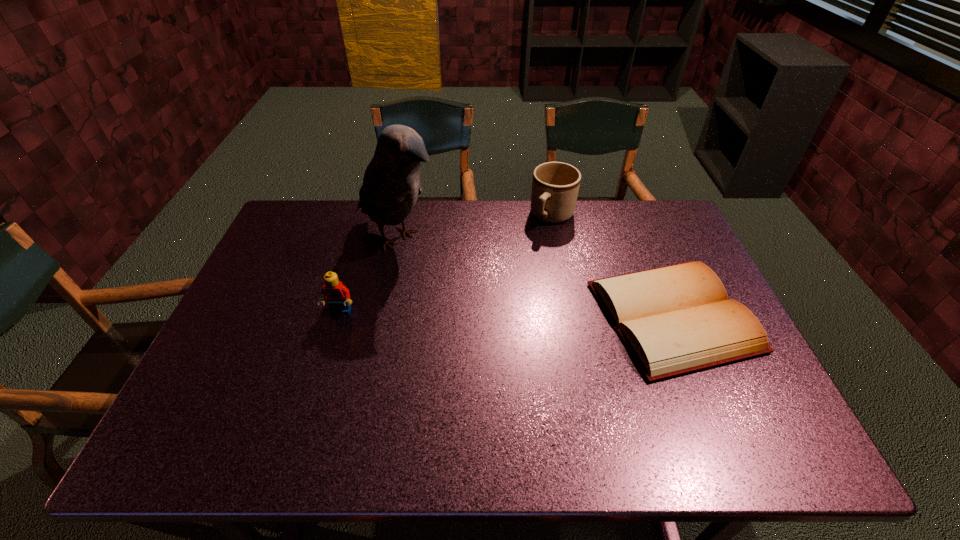
This screenshot has height=540, width=960. I want to click on vacant space on the desktop that is between the Lego and the shortest object and is positioned on the front-facing side of the tallest object, so click(513, 314).

This screenshot has height=540, width=960. Find the location of `free spot on the desktop that is between the Lego and the Bible and is positioned on the side of the mug with the handle`. free spot on the desktop that is between the Lego and the Bible and is positioned on the side of the mug with the handle is located at coordinates (478, 314).